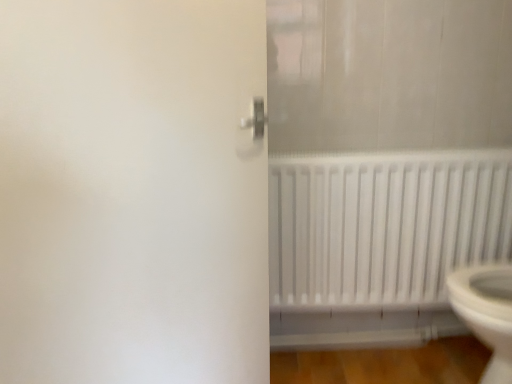
Question: From the image's perspective, relative to white matte door at left, is white matte radiator at lower right above or below?

Choices:
 (A) below
 (B) above

Answer: (A)

Question: From a real-world perspective, is white matte radiator at lower right positioned above or below white matte door at left?

Choices:
 (A) below
 (B) above

Answer: (A)

Question: Is white matte radiator at lower right inside the boundaries of white matte door at left, or outside?

Choices:
 (A) outside
 (B) inside

Answer: (A)

Question: Considering the relative positions of white matte door at left and white matte radiator at lower right in the image provided, is white matte door at left to the left or to the right of white matte radiator at lower right?

Choices:
 (A) right
 (B) left

Answer: (B)

Question: Looking at their shapes, would you say white matte door at left is wider or thinner than white matte radiator at lower right?

Choices:
 (A) thin
 (B) wide

Answer: (A)

Question: From the image's perspective, is white matte door at left positioned above or below white matte radiator at lower right?

Choices:
 (A) below
 (B) above

Answer: (B)

Question: Considering the positions of white matte door at left and white matte radiator at lower right in the image, is white matte door at left taller or shorter than white matte radiator at lower right?

Choices:
 (A) tall
 (B) short

Answer: (A)